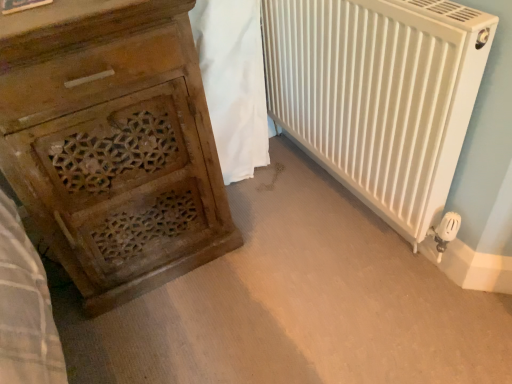
Question: Is white fabric at center looking in the opposite direction of white matte radiator at right?

Choices:
 (A) no
 (B) yes

Answer: (A)

Question: Would you say white fabric at center contains white matte radiator at right?

Choices:
 (A) no
 (B) yes

Answer: (A)

Question: Is white fabric at center not near white matte radiator at right?

Choices:
 (A) no
 (B) yes

Answer: (A)

Question: Is white fabric at center bigger than white matte radiator at right?

Choices:
 (A) yes
 (B) no

Answer: (B)

Question: Does white fabric at center appear on the right side of white matte radiator at right?

Choices:
 (A) yes
 (B) no

Answer: (B)

Question: Is white fabric at center completely or partially outside of white matte radiator at right?

Choices:
 (A) no
 (B) yes

Answer: (B)

Question: Can you confirm if wooden carved chest of drawers at left is positioned to the left of white matte radiator at right?

Choices:
 (A) no
 (B) yes

Answer: (B)

Question: Does wooden carved chest of drawers at left appear on the right side of white matte radiator at right?

Choices:
 (A) no
 (B) yes

Answer: (A)

Question: From the image's perspective, is wooden carved chest of drawers at left located above white matte radiator at right?

Choices:
 (A) yes
 (B) no

Answer: (B)

Question: Is the surface of wooden carved chest of drawers at left in direct contact with white matte radiator at right?

Choices:
 (A) no
 (B) yes

Answer: (A)

Question: From the image's perspective, is wooden carved chest of drawers at left located beneath white matte radiator at right?

Choices:
 (A) no
 (B) yes

Answer: (B)

Question: Is wooden carved chest of drawers at left facing away from white matte radiator at right?

Choices:
 (A) yes
 (B) no

Answer: (B)

Question: Considering the relative positions of white matte radiator at right and white fabric at center in the image provided, is white matte radiator at right to the left of white fabric at center from the viewer's perspective?

Choices:
 (A) yes
 (B) no

Answer: (B)